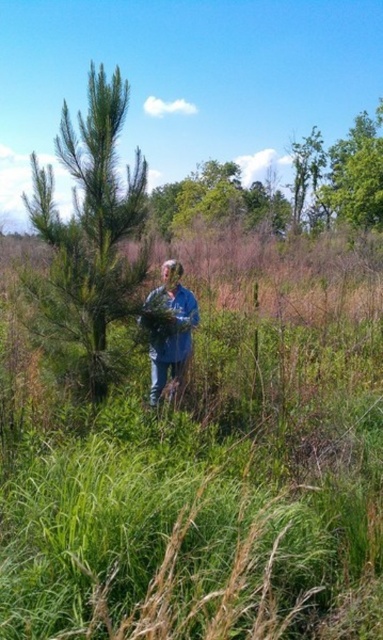
Question: Does green matte tree at center have a greater width compared to green leafy tree at upper right?

Choices:
 (A) yes
 (B) no

Answer: (B)

Question: Is green leafy tree at upper center closer to camera compared to blue denim jacket at center?

Choices:
 (A) no
 (B) yes

Answer: (A)

Question: Where is green grass at center located in relation to green leafy tree at upper center in the image?

Choices:
 (A) above
 (B) below

Answer: (B)

Question: Among these points, which one is nearest to the camera?

Choices:
 (A) (170, 372)
 (B) (294, 525)

Answer: (B)

Question: Which of these objects is positioned farthest from the blue denim jacket at center?

Choices:
 (A) green leafy tree at upper center
 (B) green leafy tree at upper right
 (C) green grass at center

Answer: (A)

Question: Based on their relative distances, which object is nearer to the green leafy tree at upper center?

Choices:
 (A) green matte tree at center
 (B) blue denim jacket at center

Answer: (B)